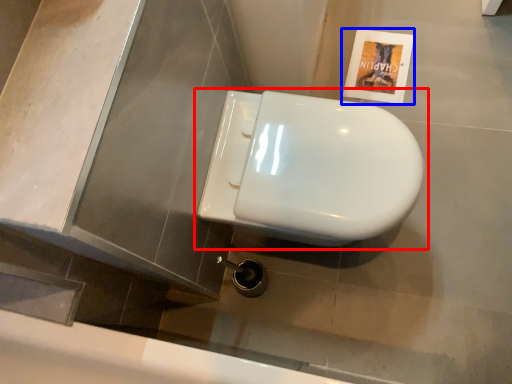
Question: Which object is closer to the camera taking this photo, toilet (highlighted by a red box) or flyer (highlighted by a blue box)?

Choices:
 (A) toilet
 (B) flyer

Answer: (A)